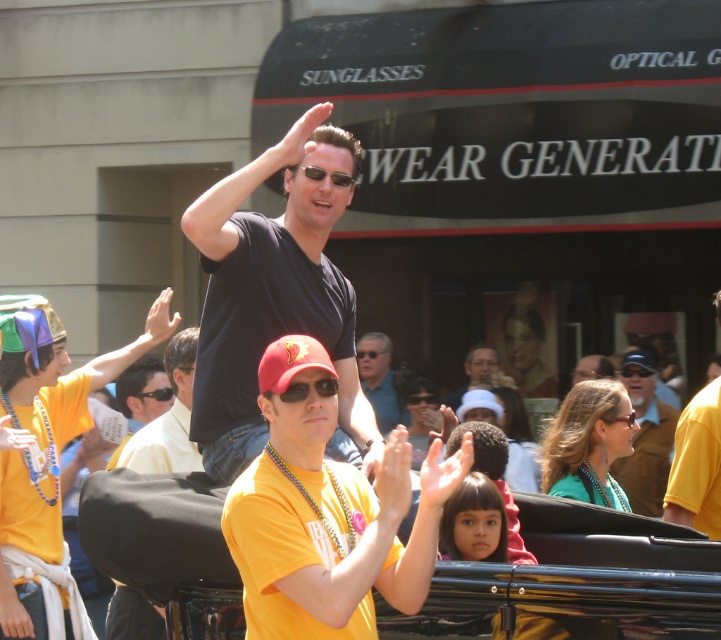
You are a photographer at the event and want to capture a clear shot of the man in the yellow matte shirt at center without the yellow fabric shirt at center blocking it. Based on their positions, is this possible?

The yellow matte shirt at center is located above the yellow fabric shirt at center, so it is possible to capture a clear shot of the yellow matte shirt at center without the yellow fabric shirt at center blocking it by focusing on the upper part of the frame.